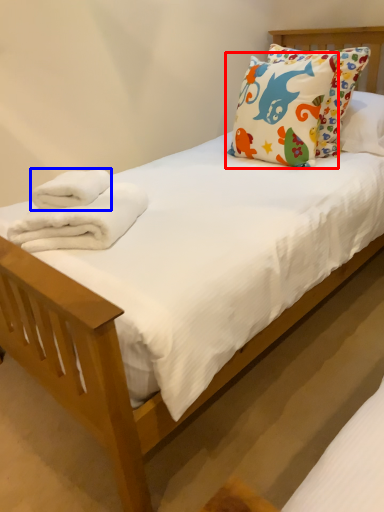
Question: Which object is further to the camera taking this photo, pillow (highlighted by a red box) or bath towel (highlighted by a blue box)?

Choices:
 (A) pillow
 (B) bath towel

Answer: (A)